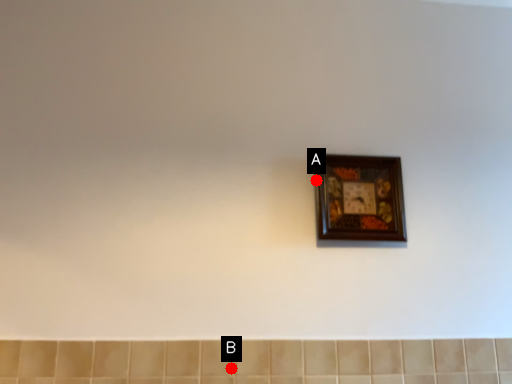
Question: Two points are circled on the image, labeled by A and B beside each circle. Which point is closer to the camera?

Choices:
 (A) A is closer
 (B) B is closer

Answer: (B)